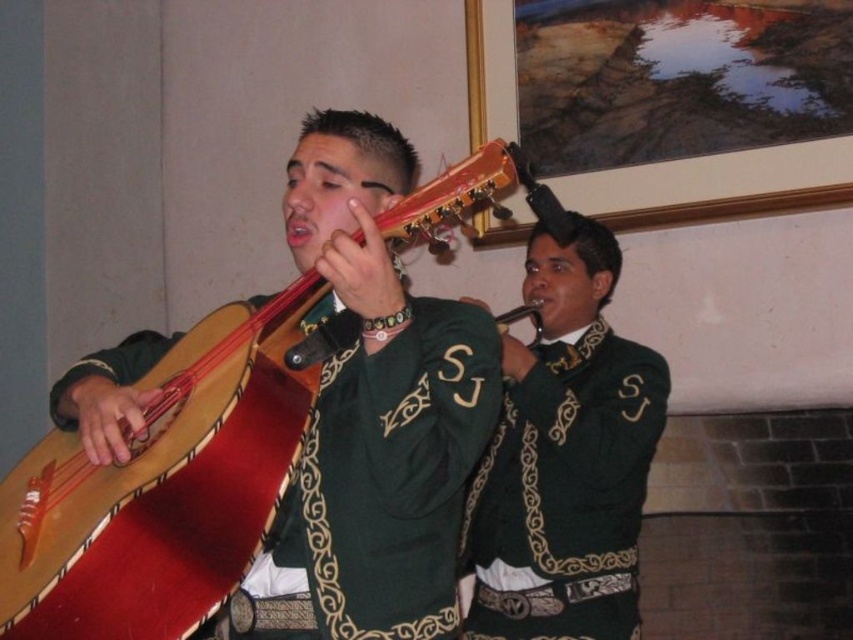
Question: Which object is farther from the camera taking this photo?

Choices:
 (A) green matte jacket at center
 (B) green velvet vest at center
 (C) wooden acoustic guitar at left

Answer: (A)

Question: In this image, where is wooden acoustic guitar at left located relative to green velvet vest at center?

Choices:
 (A) below
 (B) above

Answer: (B)

Question: Is wooden acoustic guitar at left to the left of green matte jacket at center from the viewer's perspective?

Choices:
 (A) yes
 (B) no

Answer: (A)

Question: Which object appears farthest from the camera in this image?

Choices:
 (A) wooden acoustic guitar at left
 (B) green velvet vest at center
 (C) green matte jacket at center

Answer: (C)

Question: Which point is farther to the camera?

Choices:
 (A) (579, 307)
 (B) (433, 561)

Answer: (A)

Question: Is wooden acoustic guitar at left smaller than green velvet vest at center?

Choices:
 (A) yes
 (B) no

Answer: (B)